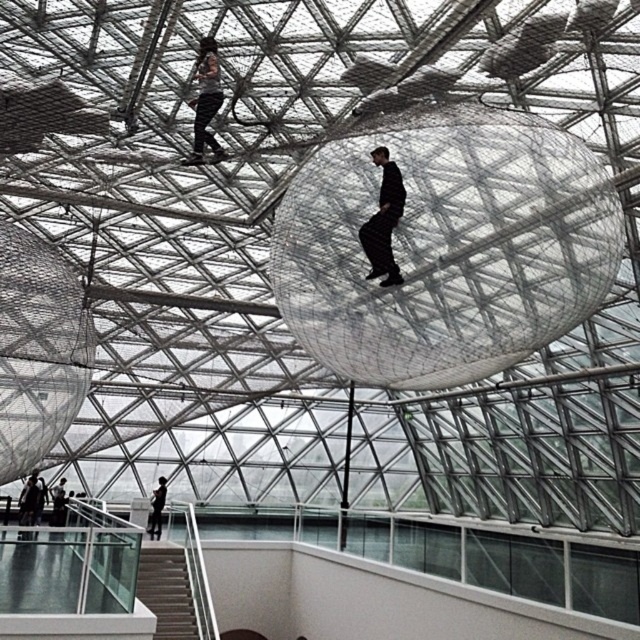
Question: Does black matte suit at center have a lesser width compared to black matte person at lower center?

Choices:
 (A) no
 (B) yes

Answer: (B)

Question: Can you confirm if transparent mesh bubble at center is wider than black matte suit at center?

Choices:
 (A) yes
 (B) no

Answer: (A)

Question: Which point is closer to the camera taking this photo?

Choices:
 (A) (200, 70)
 (B) (307, 237)
 (C) (140, 593)

Answer: (B)

Question: Does white glossy stair at lower left appear on the right side of black matte suit at center?

Choices:
 (A) no
 (B) yes

Answer: (A)

Question: Which point is closer to the camera taking this photo?

Choices:
 (A) (394, 196)
 (B) (173, 593)

Answer: (A)

Question: Estimate the real-world distances between objects in this image. Which object is closer to the matte black pants at upper center?

Choices:
 (A) white glossy stair at lower left
 (B) black matte suit at center
 (C) transparent mesh bubble at center
 (D) black matte person at lower center

Answer: (B)